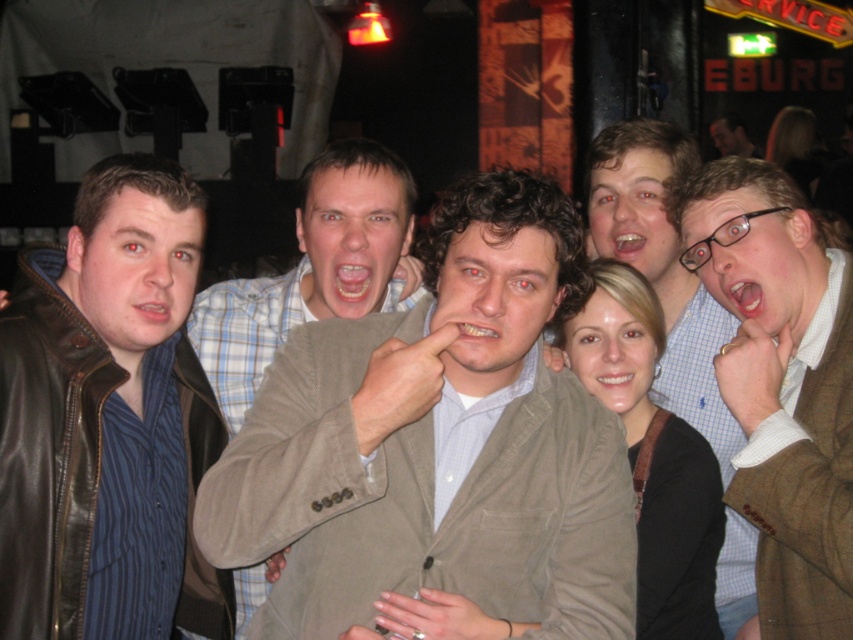
Between point (79, 316) and point (741, 150), which one is positioned behind?

Point (741, 150)

How distant is leather jacket at left from light brown leather jacket at upper right?

They are 22.83 meters apart.

Does point (82, 545) come farther from viewer compared to point (746, 141)?

No, it is not.

Locate an element on the screen. This screenshot has width=853, height=640. leather jacket at left is located at coordinates (108, 420).

Is brown textured blazer at center to the right of brown textured blazer at upper right from the viewer's perspective?

Yes, brown textured blazer at center is to the right of brown textured blazer at upper right.

Does brown textured blazer at center have a greater height compared to brown textured blazer at upper right?

Yes, brown textured blazer at center is taller than brown textured blazer at upper right.

You are a GUI agent. You are given a task and a screenshot of the screen. Output one action in this format:
    pyautogui.click(x=<x>, y=<y>)
    Task: Click on the brown textured blazer at center
    The height and width of the screenshot is (640, 853).
    Given the screenshot: What is the action you would take?
    pyautogui.click(x=781, y=385)

Which is below, brown textured blazer at center or light brown leather jacket at upper right?

brown textured blazer at center is below.

Consider the image. Does brown textured blazer at center have a larger size compared to light brown leather jacket at upper right?

Yes.

Where is `brown textured blazer at center`? brown textured blazer at center is located at coordinates (781, 385).

At what (x,y) coordinates should I click in order to perform the action: click on brown textured blazer at center. Please return your answer as a coordinate pair (x, y). The image size is (853, 640). Looking at the image, I should click on (x=781, y=385).